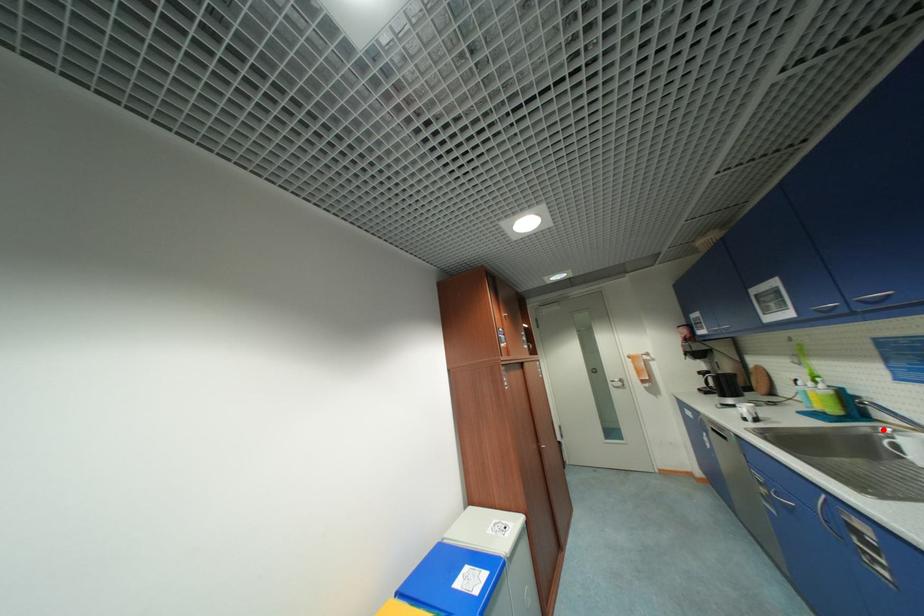
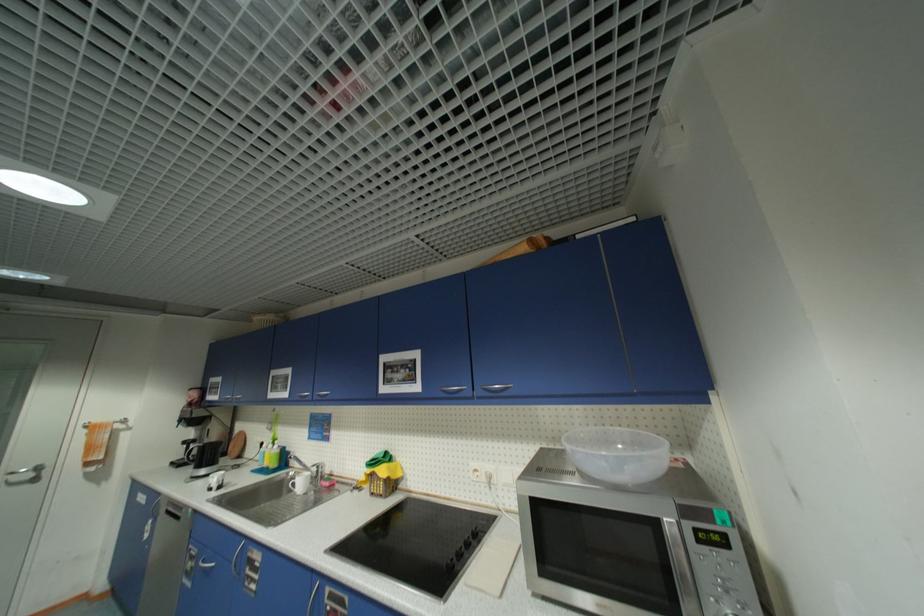
Locate, in the second image, the point that corresponds to the highlighted location in the first image.

(294, 475)